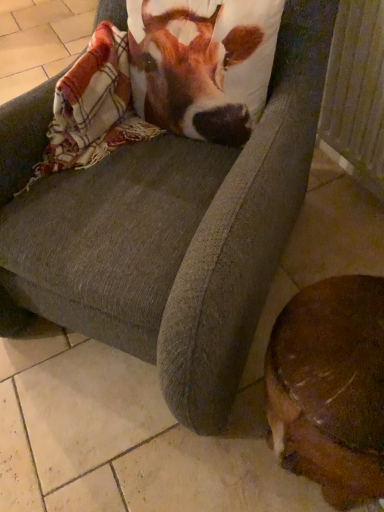
Question: Can you confirm if wooden radiator at lower right is shorter than brown and white fabric at upper center?

Choices:
 (A) yes
 (B) no

Answer: (B)

Question: Could you tell me if wooden radiator at lower right is turned towards brown and white fabric at upper center?

Choices:
 (A) no
 (B) yes

Answer: (B)

Question: Does wooden radiator at lower right come in front of brown and white fabric at upper center?

Choices:
 (A) yes
 (B) no

Answer: (B)

Question: From a real-world perspective, is wooden radiator at lower right located beneath brown and white fabric at upper center?

Choices:
 (A) yes
 (B) no

Answer: (A)

Question: Can you confirm if wooden radiator at lower right is thinner than brown and white fabric at upper center?

Choices:
 (A) yes
 (B) no

Answer: (A)

Question: From a real-world perspective, is wooden radiator at lower right positioned over brown and white fabric at upper center based on gravity?

Choices:
 (A) no
 (B) yes

Answer: (A)

Question: Can you confirm if brown furry dog at lower right is smaller than wooden radiator at lower right?

Choices:
 (A) no
 (B) yes

Answer: (A)

Question: Is wooden radiator at lower right located within brown furry dog at lower right?

Choices:
 (A) no
 (B) yes

Answer: (A)

Question: Is brown furry dog at lower right looking in the opposite direction of wooden radiator at lower right?

Choices:
 (A) yes
 (B) no

Answer: (B)

Question: Is brown furry dog at lower right far away from wooden radiator at lower right?

Choices:
 (A) no
 (B) yes

Answer: (A)

Question: Is brown furry dog at lower right wider than wooden radiator at lower right?

Choices:
 (A) yes
 (B) no

Answer: (A)

Question: Is the surface of brown furry dog at lower right in direct contact with wooden radiator at lower right?

Choices:
 (A) no
 (B) yes

Answer: (A)

Question: Does brown furry dog at lower right have a greater width compared to plaid woolen blanket at upper left?

Choices:
 (A) no
 (B) yes

Answer: (B)